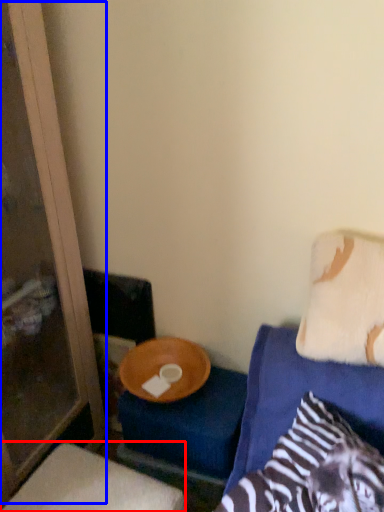
Question: Which object appears closest to the camera in this image, furniture (highlighted by a red box) or screen door (highlighted by a blue box)?

Choices:
 (A) furniture
 (B) screen door

Answer: (B)